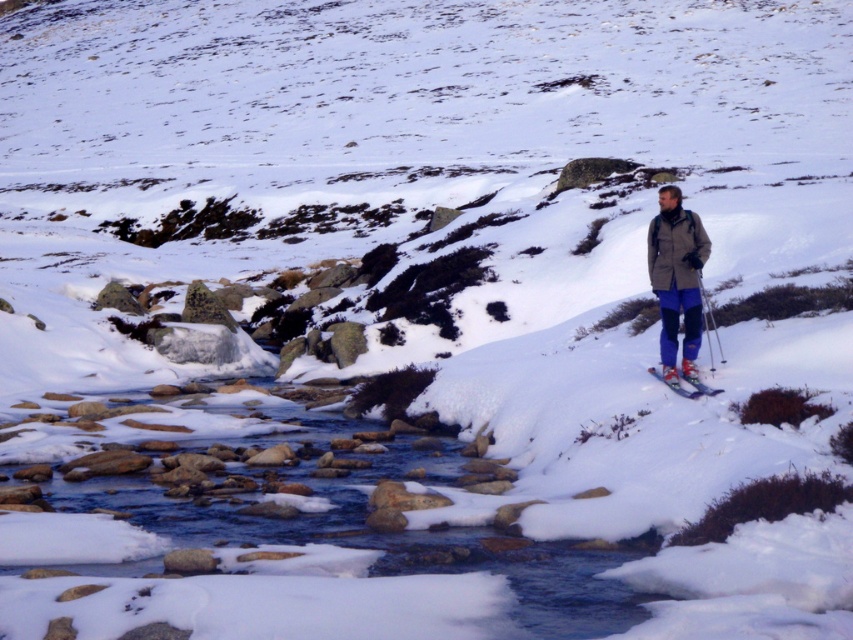
Question: Is the position of matte gray jacket at right less distant than that of matte blue ski at center right?

Choices:
 (A) yes
 (B) no

Answer: (B)

Question: Is matte gray jacket at right positioned in front of matte blue ski at center right?

Choices:
 (A) no
 (B) yes

Answer: (A)

Question: Can you confirm if matte gray jacket at right is positioned above matte blue ski at center right?

Choices:
 (A) yes
 (B) no

Answer: (A)

Question: Which object is farther from the camera taking this photo?

Choices:
 (A) matte gray jacket at right
 (B) matte blue ski at center right

Answer: (A)

Question: Which point appears closest to the camera in this image?

Choices:
 (A) (676, 388)
 (B) (700, 316)

Answer: (A)

Question: Which of the following is the closest to the observer?

Choices:
 (A) (683, 387)
 (B) (695, 227)

Answer: (A)